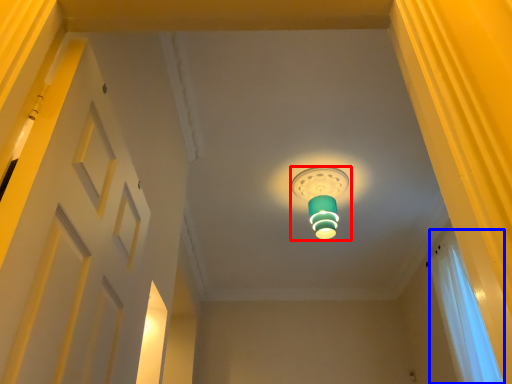
Question: Which of the following is the closest to the observer, lamp (highlighted by a red box) or curtain (highlighted by a blue box)?

Choices:
 (A) lamp
 (B) curtain

Answer: (B)